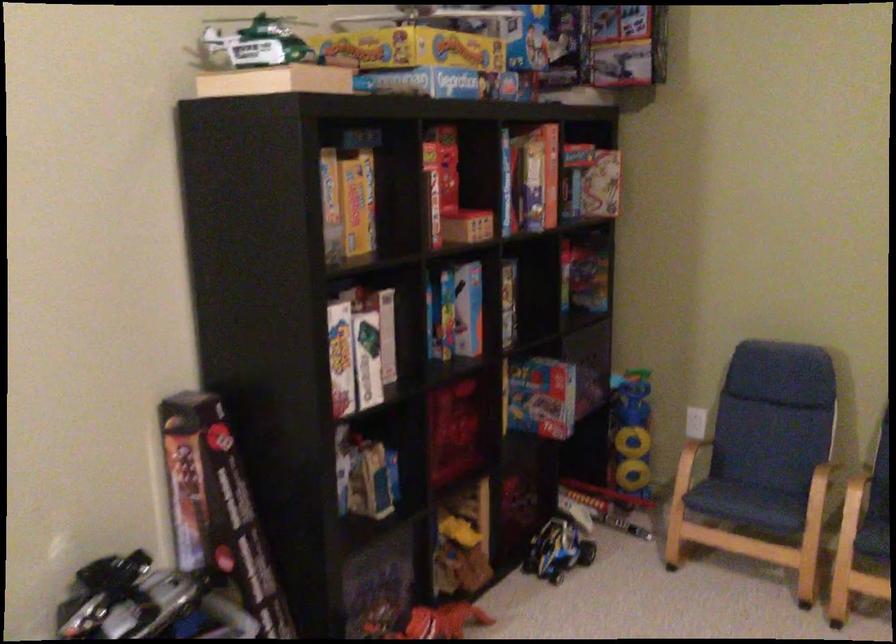
The location [186,471] corresponds to which object?

It corresponds to the long game box in the image.